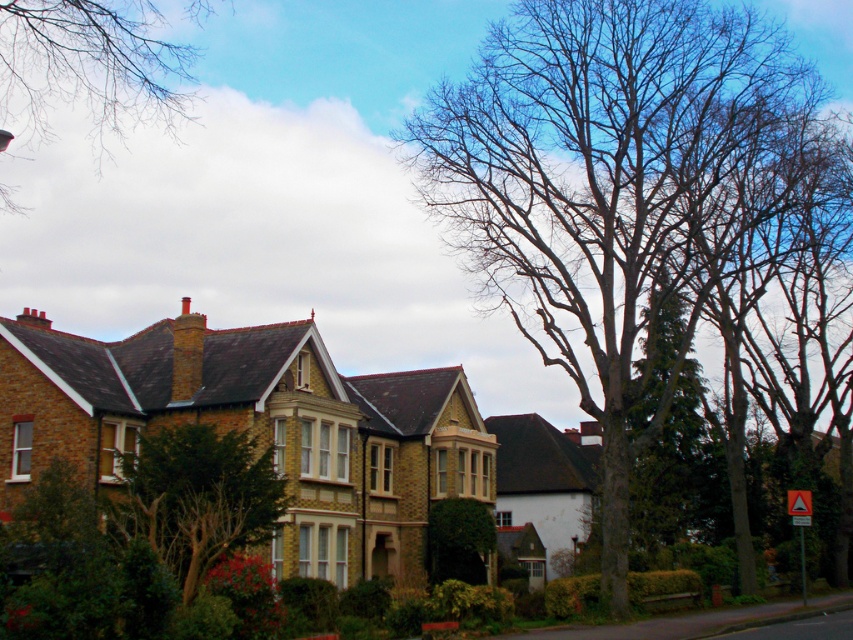
You are a pedestrian standing on the residential street and see the green leafy tree at center and the yellow reflective triangle at lower right. Which object is closer to you?

The green leafy tree at center is closer to you because it is in front of the yellow reflective triangle at lower right.

You are driving a car and notice the green leafy tree at center and the orange reflective triangle at lower right. Which object takes up more horizontal space in the scene?

The green leafy tree at center takes up more horizontal space than the orange reflective triangle at lower right because its width is larger.